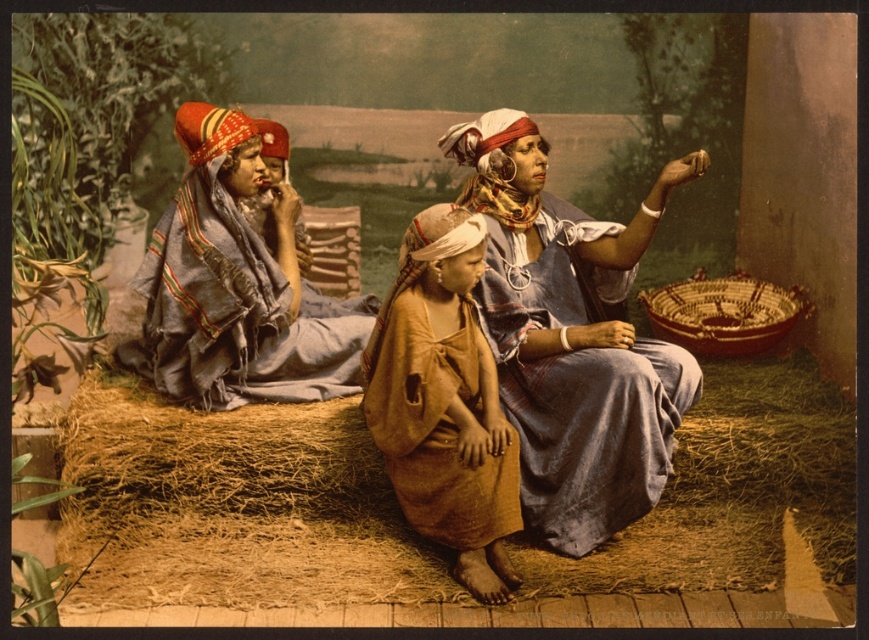
Does brown woven basket at lower right appear over red woven fabric headscarf at center?

No.

Does brown woven basket at lower right have a lesser height compared to red woven fabric headscarf at center?

Yes, brown woven basket at lower right is shorter than red woven fabric headscarf at center.

Which is in front, point (662, 326) or point (482, 176)?

Positioned in front is point (482, 176).

Where is `brown woven basket at lower right`? brown woven basket at lower right is located at coordinates (722, 314).

Between blue woven cloth at left and brown woven cloth at center, which one appears on the left side from the viewer's perspective?

blue woven cloth at left

Is blue woven cloth at left above brown woven cloth at center?

Yes, blue woven cloth at left is above brown woven cloth at center.

Describe the element at coordinates (233, 285) in the screenshot. The image size is (869, 640). I see `blue woven cloth at left` at that location.

I want to click on blue woven cloth at left, so click(233, 285).

Between matte blue dress at center and brown woven basket at lower right, which one has less height?

With less height is brown woven basket at lower right.

What do you see at coordinates (571, 337) in the screenshot? This screenshot has height=640, width=869. I see `matte blue dress at center` at bounding box center [571, 337].

Locate an element on the screen. Image resolution: width=869 pixels, height=640 pixels. matte blue dress at center is located at coordinates (571, 337).